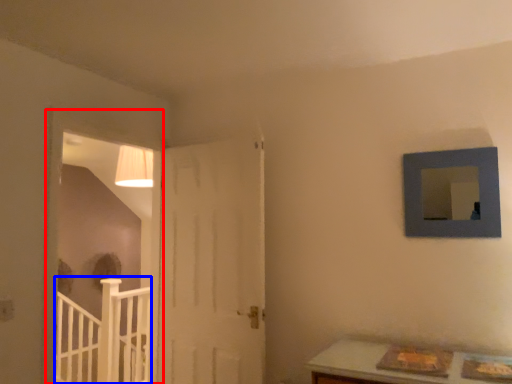
Question: Which of the following is the farthest to the observer, window frame (highlighted by a red box) or rail (highlighted by a blue box)?

Choices:
 (A) window frame
 (B) rail

Answer: (B)